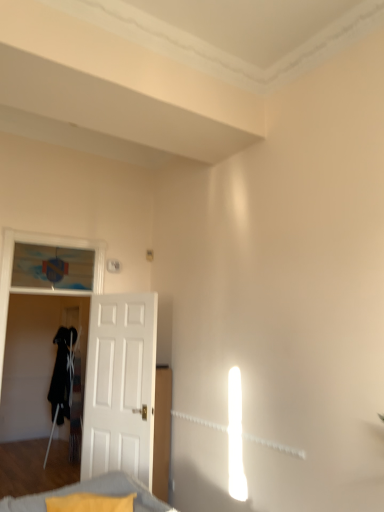
Question: Looking at their shapes, would you say soft gray fabric cushion at lower left is wider or thinner than white wooden door at left?

Choices:
 (A) thin
 (B) wide

Answer: (B)

Question: From the image's perspective, is soft gray fabric cushion at lower left located above or below white wooden door at left?

Choices:
 (A) below
 (B) above

Answer: (A)

Question: Is soft gray fabric cushion at lower left taller or shorter than white wooden door at left?

Choices:
 (A) tall
 (B) short

Answer: (B)

Question: Is white wooden door at left to the left or to the right of soft gray fabric cushion at lower left in the image?

Choices:
 (A) right
 (B) left

Answer: (B)

Question: Is point (92, 423) closer or farther from the camera than point (153, 506)?

Choices:
 (A) closer
 (B) farther

Answer: (B)

Question: In terms of width, does white wooden door at left look wider or thinner when compared to soft gray fabric cushion at lower left?

Choices:
 (A) thin
 (B) wide

Answer: (A)

Question: Based on their sizes in the image, would you say white wooden door at left is bigger or smaller than soft gray fabric cushion at lower left?

Choices:
 (A) small
 (B) big

Answer: (B)